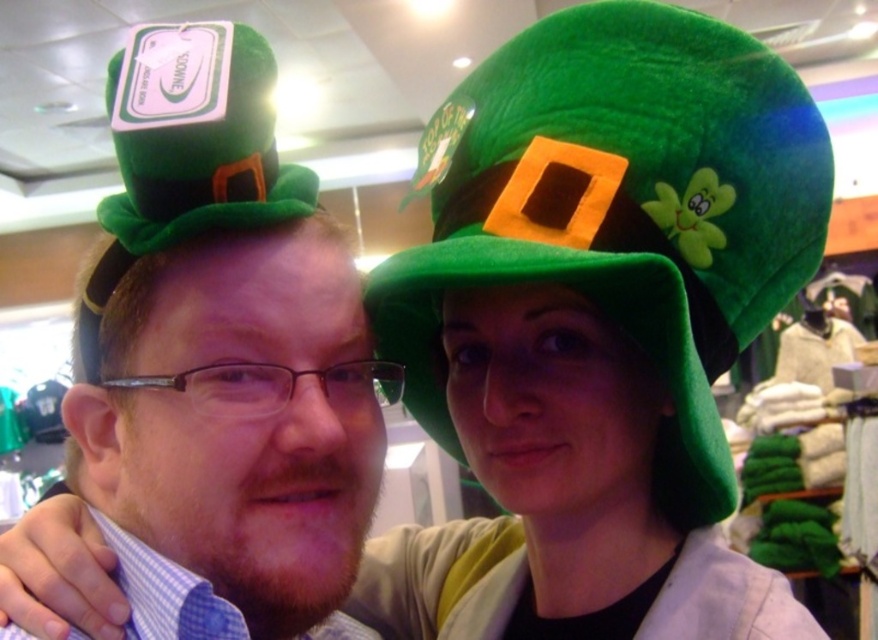
From the picture: You are a customer in a store looking for a hat to wear for St. Patrick s Day. You see two people wearing hats. One has a blue checkered shirt and glasses, and the other has a green hat with a yellow buckle and a smiling shamrock. The point at coordinates (621, 209) is on the hat you want. Which hat should you choose?

The point at coordinates (621, 209) is on the velvety green hat at upper right, so you should choose the green hat with a yellow buckle and a smiling shamrock decoration.